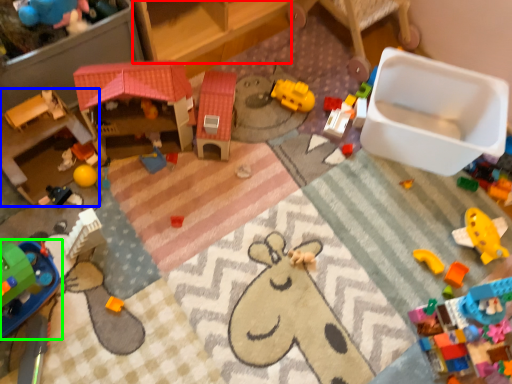
Question: Which object is positioned farthest from furniture (highlighted by a red box)? Select from toy (highlighted by a blue box) and toy (highlighted by a green box).

Choices:
 (A) toy
 (B) toy

Answer: (B)